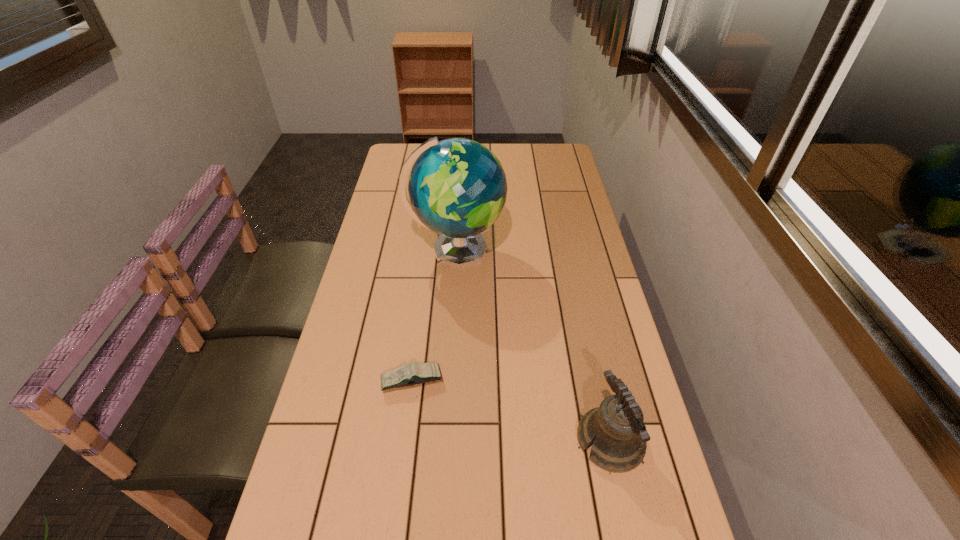
The image size is (960, 540). I want to click on diary located in the left edge section of the desktop, so pos(415,373).

The image size is (960, 540). I want to click on object that is at the right edge, so click(617, 427).

In the image, there is a desktop. At what (x,y) coordinates should I click in order to perform the action: click on vacant space at the far edge. Please return your answer as a coordinate pair (x, y). This screenshot has width=960, height=540. Looking at the image, I should click on (522, 154).

Locate an element on the screen. This screenshot has width=960, height=540. free location at the left edge is located at coordinates (366, 271).

Where is `free region at the right edge`? The height and width of the screenshot is (540, 960). free region at the right edge is located at coordinates (585, 308).

What are the coordinates of `free spot at the far right corner of the desktop` in the screenshot? It's located at (545, 149).

The image size is (960, 540). In order to click on unoccupied position between the shortest object and the nearest object in this screenshot , I will do `click(511, 410)`.

Where is `unoccupied position between the diary and the globe`? This screenshot has width=960, height=540. unoccupied position between the diary and the globe is located at coordinates (434, 315).

This screenshot has width=960, height=540. In order to click on free space between the rightmost object and the shortest object in this screenshot , I will do `click(511, 410)`.

What are the coordinates of `empty space between the shortest object and the tallest object` in the screenshot? It's located at (434, 315).